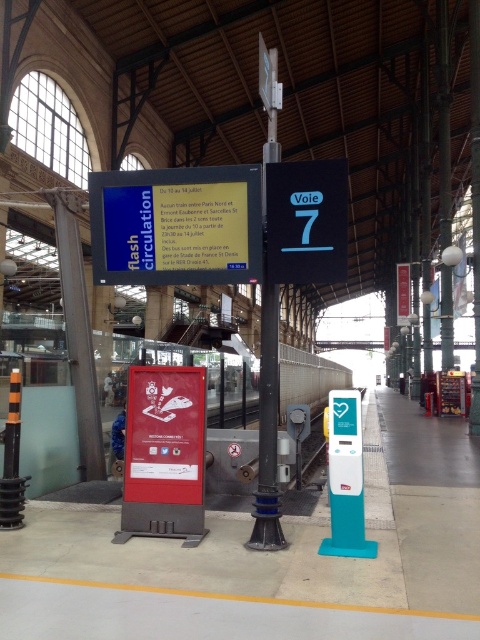
Question: Does black plastic sign at center lie behind metallic glass pillar at left?

Choices:
 (A) yes
 (B) no

Answer: (B)

Question: Is blue glossy signboard at center bigger than black plastic sign at center?

Choices:
 (A) yes
 (B) no

Answer: (A)

Question: Which point is farther from the camera taking this photo?

Choices:
 (A) (155, 179)
 (B) (81, 305)

Answer: (B)

Question: Which point is farther to the camera?

Choices:
 (A) metallic pole at center
 (B) blue glossy signboard at center
 (C) metallic glass pillar at left

Answer: (C)

Question: Is the position of metallic pole at center less distant than that of metallic glass pillar at left?

Choices:
 (A) yes
 (B) no

Answer: (A)

Question: Which point is farther from the camera taking this photo?

Choices:
 (A) (111, 266)
 (B) (81, 305)
 (C) (272, 116)
 (D) (295, 168)

Answer: (B)